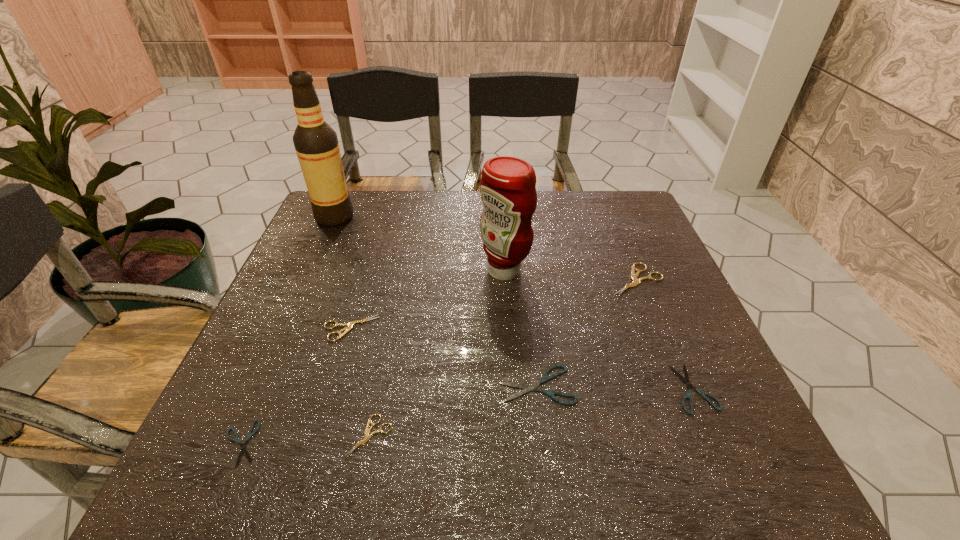
You are a GUI agent. You are given a task and a screenshot of the screen. Output one action in this format:
    pyautogui.click(x=<x>, y=<y>)
    Task: Click on the vacant space located 0.180m on the left of the rightmost black shears
    
    Given the screenshot: What is the action you would take?
    pyautogui.click(x=582, y=388)

Locate an element on the screen. The width and height of the screenshot is (960, 540). free spot located 0.260m on the right of the shortest object is located at coordinates (410, 443).

Where is `object present at the far edge`? object present at the far edge is located at coordinates (316, 143).

Find the location of a particular element. alcohol located in the left edge section of the desktop is located at coordinates pos(316,143).

Find the location of a particular element. object situated at the far left corner is located at coordinates (316, 143).

Where is `object situated at the near left corner`? The image size is (960, 540). object situated at the near left corner is located at coordinates point(243,446).

In the image, there is a desktop. In order to click on vacant area at the far edge in this screenshot , I will do `click(440, 214)`.

Locate an element on the screen. vacant space at the near edge of the desktop is located at coordinates (456, 492).

In the image, there is a desktop. Identify the location of free space at the left edge. (299, 315).

I want to click on vacant space at the right edge, so click(x=630, y=238).